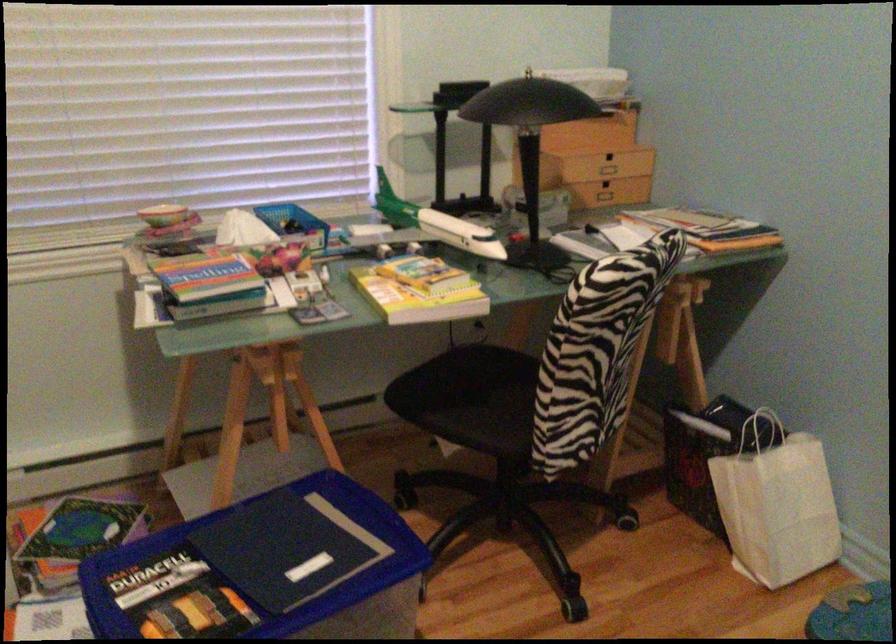
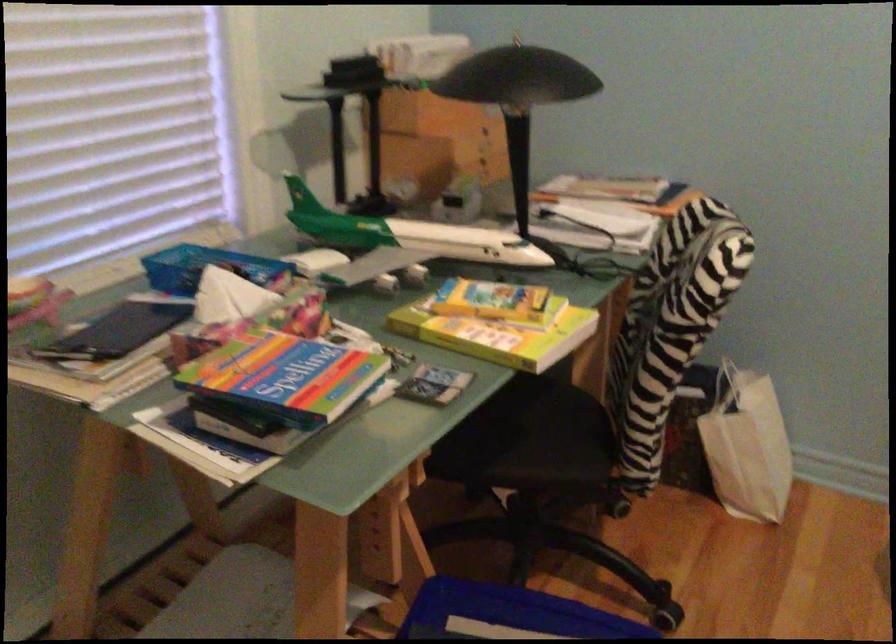
Locate, in the second image, the point that corresponds to [405,292] in the first image.

(497, 330)